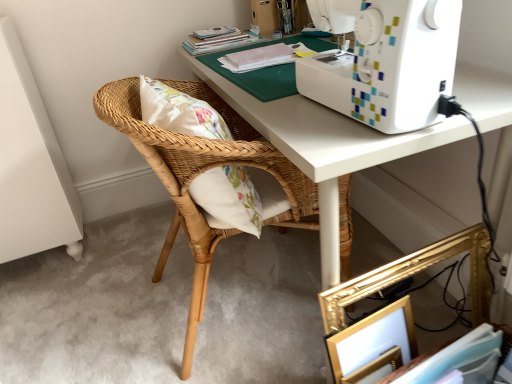
Where is `unoccupied region to the right of white plastic sewing machine at upper right`? The image size is (512, 384). unoccupied region to the right of white plastic sewing machine at upper right is located at coordinates (478, 90).